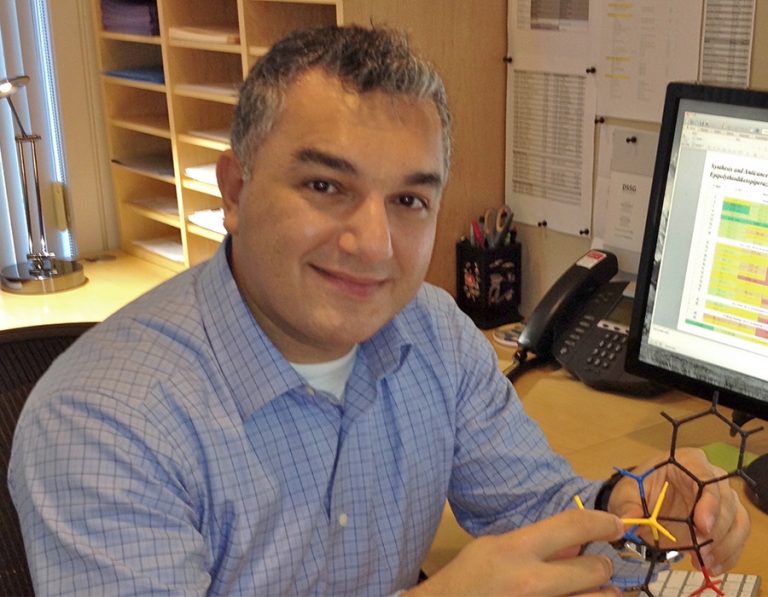
Locate an element on the screen. This screenshot has height=597, width=768. desk is located at coordinates coord(584,429).